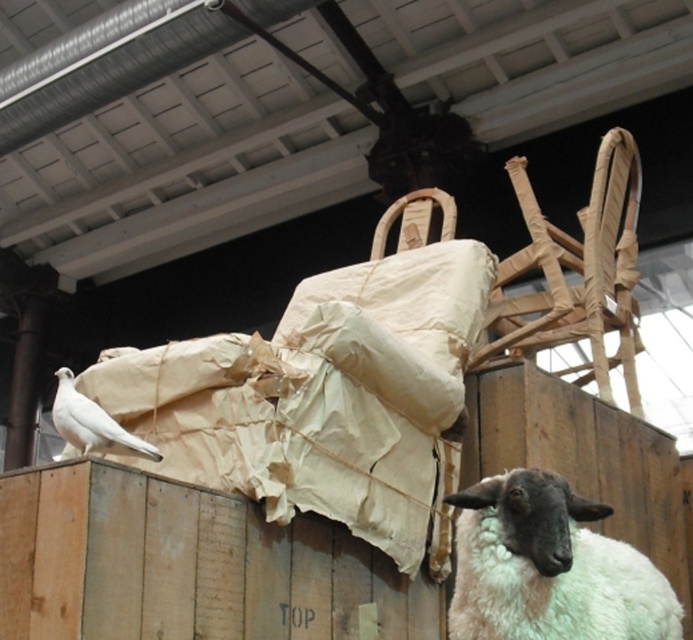
Question: Is white woolen sheep at lower right positioned in front of white matte dove at left?

Choices:
 (A) no
 (B) yes

Answer: (B)

Question: Can you confirm if white woolen sheep at lower right is wider than white matte dove at left?

Choices:
 (A) no
 (B) yes

Answer: (B)

Question: Which point appears farthest from the camera in this image?

Choices:
 (A) pos(80,436)
 (B) pos(665,608)

Answer: (A)

Question: Among these points, which one is farthest from the camera?

Choices:
 (A) (94, 420)
 (B) (532, 492)

Answer: (A)

Question: Does white woolen sheep at lower right appear over white matte dove at left?

Choices:
 (A) yes
 (B) no

Answer: (B)